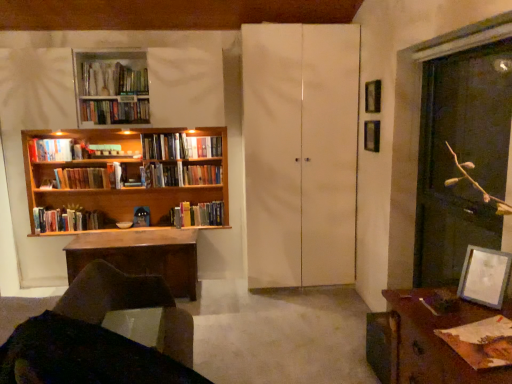
This screenshot has height=384, width=512. I want to click on vacant space behind matte brown book at lower right, the first book in the front-to-back sequence, so click(450, 309).